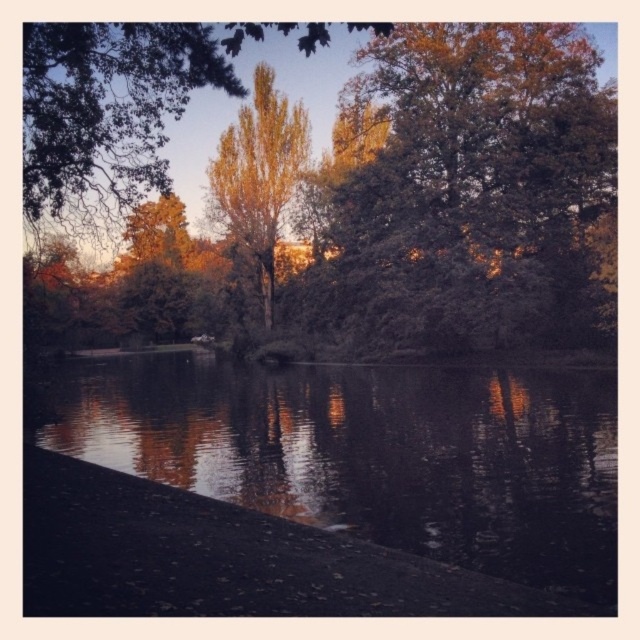
Does smooth dark water at bottom center appear on the right side of green leafy tree at upper center?

In fact, smooth dark water at bottom center is to the left of green leafy tree at upper center.

Which of these two, smooth dark water at bottom center or green leafy tree at upper center, stands taller?

green leafy tree at upper center

Which is in front, point (353, 476) or point (452, 90)?

Positioned in front is point (353, 476).

The width and height of the screenshot is (640, 640). Identify the location of smooth dark water at bottom center. (372, 452).

Which of these two, green leafy tree at upper center or golden leafy tree at upper center, stands shorter?

green leafy tree at upper center is shorter.

Which is more to the right, green leafy tree at upper center or golden leafy tree at upper center?

From the viewer's perspective, green leafy tree at upper center appears more on the right side.

Describe the element at coordinates (476, 186) in the screenshot. I see `green leafy tree at upper center` at that location.

Image resolution: width=640 pixels, height=640 pixels. I want to click on green leafy tree at upper center, so click(x=476, y=186).

Between golden leafy tree at upper center and golden textured tree at center, which one has more height?

golden leafy tree at upper center is taller.

Can you confirm if golden leafy tree at upper center is thinner than golden textured tree at center?

No.

Locate an element on the screen. This screenshot has width=640, height=640. golden leafy tree at upper center is located at coordinates (124, 106).

Locate an element on the screen. golden leafy tree at upper center is located at coordinates (124, 106).